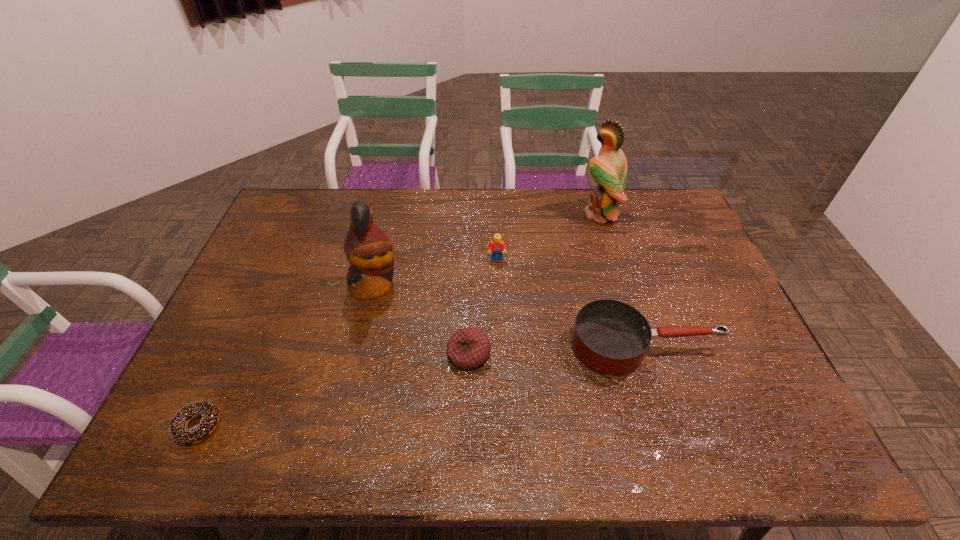
Where is `free region located on the front-facing side of the farther parrot`? The height and width of the screenshot is (540, 960). free region located on the front-facing side of the farther parrot is located at coordinates (525, 214).

Image resolution: width=960 pixels, height=540 pixels. I want to click on free point located 0.280m on the front-facing side of the farther parrot, so click(503, 214).

Find the location of a particular element. The image size is (960, 540). vacant space situated on the front-facing side of the farther parrot is located at coordinates (519, 214).

Identify the location of vacant region located 0.120m on the face of the fifth object from right to left. (438, 285).

Image resolution: width=960 pixels, height=540 pixels. In order to click on vacant space located 0.230m on the face of the fifth nearest object in this screenshot , I will do `click(499, 319)`.

Locate an element on the screen. The image size is (960, 540). vacant region located 0.380m on the left of the fifth tallest object is located at coordinates (303, 354).

Find the location of a particular element. The width and height of the screenshot is (960, 540). vacant point located on the back of the doughnut is located at coordinates (225, 370).

Where is `object at the far edge`? The image size is (960, 540). object at the far edge is located at coordinates (609, 169).

This screenshot has width=960, height=540. I want to click on object at the near edge, so click(178, 430).

Identify the location of object that is at the left edge. This screenshot has height=540, width=960. (178, 430).